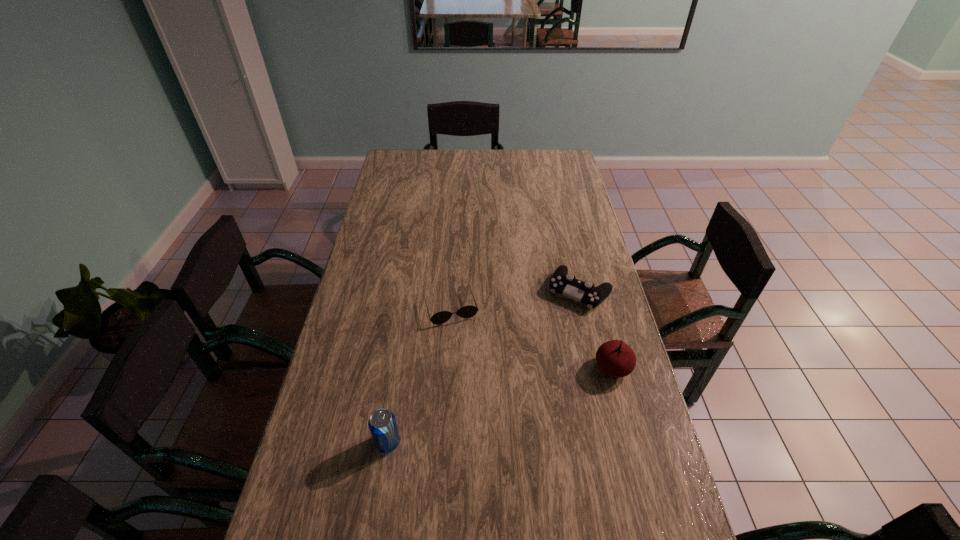
Where is `beer can`? beer can is located at coordinates pyautogui.click(x=382, y=424).

At what (x,y) coordinates should I click in order to perform the action: click on the nearest object. Please return your answer as a coordinate pair (x, y). This screenshot has width=960, height=540. Looking at the image, I should click on (382, 424).

The height and width of the screenshot is (540, 960). I want to click on the third farthest object, so (615, 358).

Find the location of a particular element. tomato is located at coordinates (615, 358).

This screenshot has width=960, height=540. I want to click on the second object from left to right, so click(469, 311).

In order to click on the shortest object in this screenshot , I will do `click(469, 311)`.

The height and width of the screenshot is (540, 960). Find the location of `control`. control is located at coordinates 562,282.

At what (x,y) coordinates should I click in order to perform the action: click on free location located 0.090m on the front of the nearest object. Please return your answer as a coordinate pair (x, y). The width and height of the screenshot is (960, 540). Looking at the image, I should click on (380, 492).

This screenshot has height=540, width=960. What are the coordinates of `vacant area located on the back of the tomato` in the screenshot? It's located at (598, 310).

Identify the location of vacant space located on the front-facing side of the second object from left to right. (483, 412).